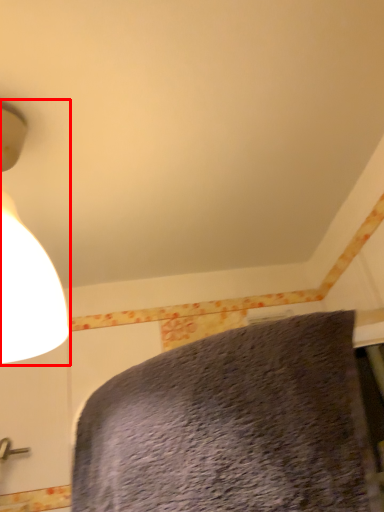
Question: From the image's perspective, considering the relative positions of lamp (annotated by the red box) and bed in the image provided, where is lamp (annotated by the red box) located with respect to the staircase?

Choices:
 (A) above
 (B) below

Answer: (A)